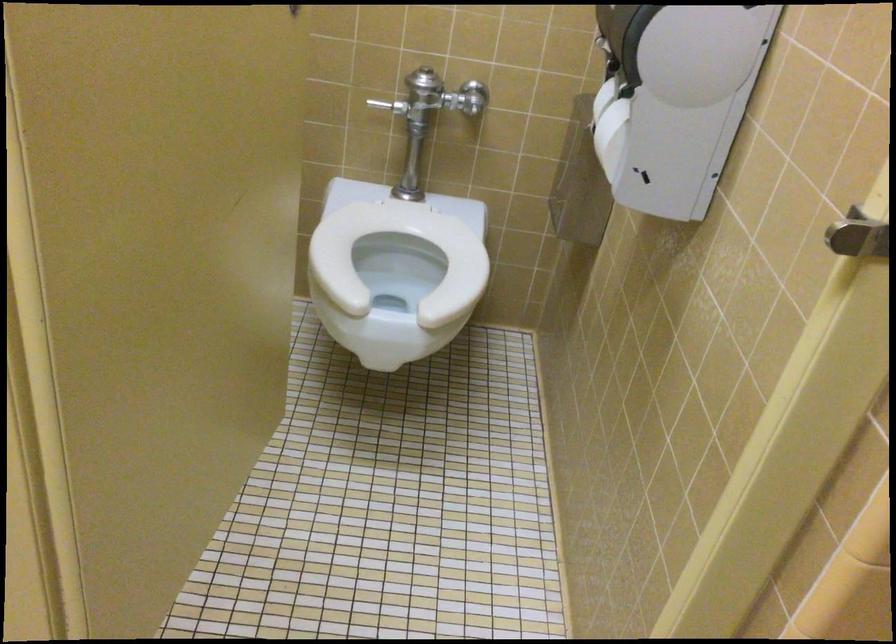
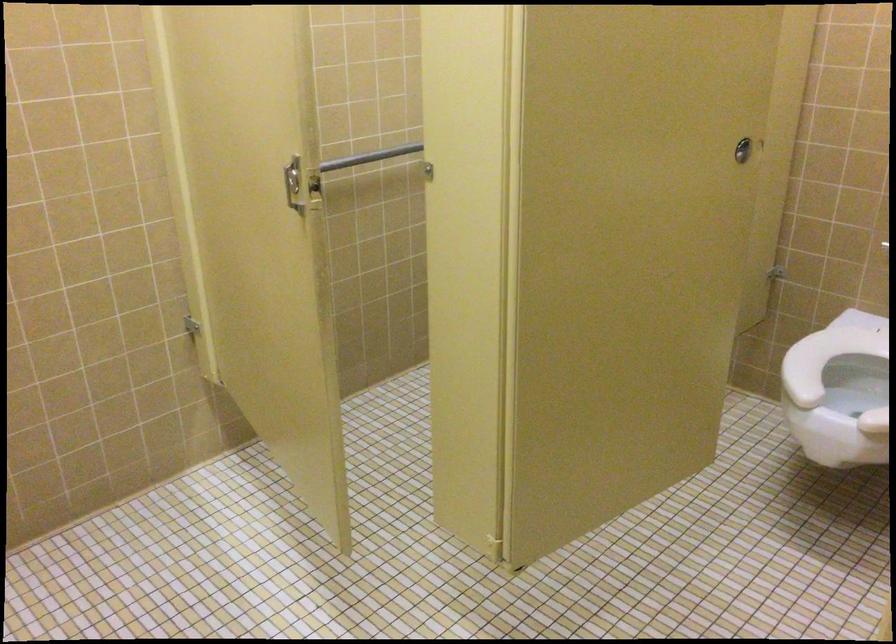
Question: How did the camera likely rotate?

Choices:
 (A) Left
 (B) Right
 (C) Up
 (D) Down

Answer: (A)